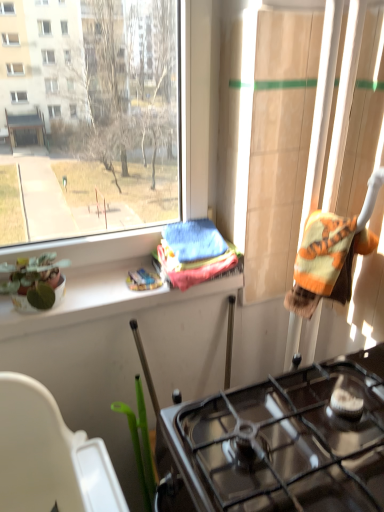
Question: Considering the relative positions of green glossy plant pot at lower left and black glass gas stove at lower center in the image provided, is green glossy plant pot at lower left to the left or to the right of black glass gas stove at lower center?

Choices:
 (A) left
 (B) right

Answer: (A)

Question: Choose the correct answer: Is green glossy plant pot at lower left inside black glass gas stove at lower center or outside it?

Choices:
 (A) outside
 (B) inside

Answer: (A)

Question: Estimate the real-world distances between objects in this image. Which object is farther from the transparent glass window at center?

Choices:
 (A) green matte plant pot at left
 (B) green glossy plant pot at lower left
 (C) black glass gas stove at lower center

Answer: (C)

Question: Considering the real-world distances, which object is farthest from the transparent glass window at center?

Choices:
 (A) green glossy plant pot at lower left
 (B) green matte plant pot at left
 (C) black glass gas stove at lower center

Answer: (C)